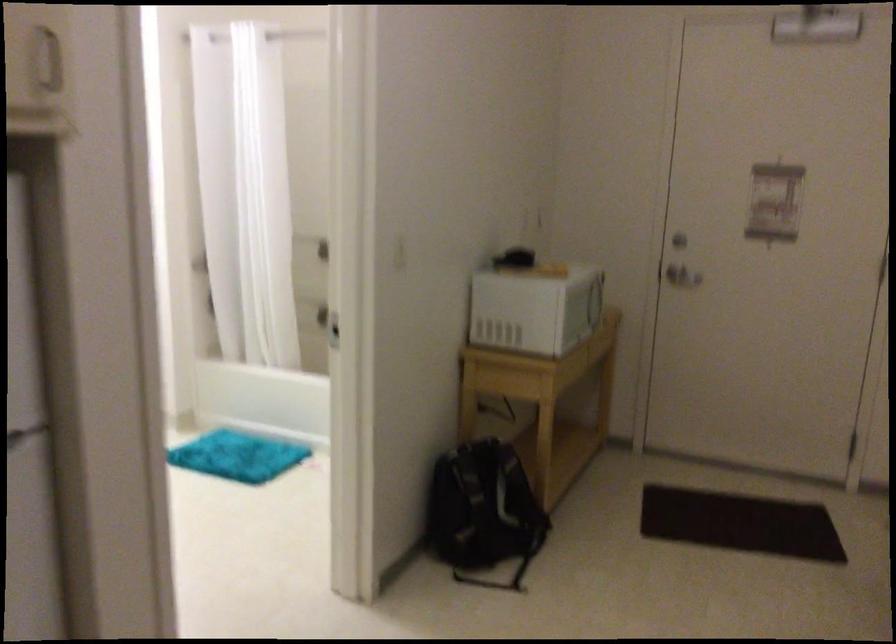
You are a GUI agent. You are given a task and a screenshot of the screen. Output one action in this format:
    pyautogui.click(x=<x>, y=<y>)
    Task: Click on the silver door handle
    The height and width of the screenshot is (644, 896).
    Given the screenshot: What is the action you would take?
    pyautogui.click(x=679, y=265)